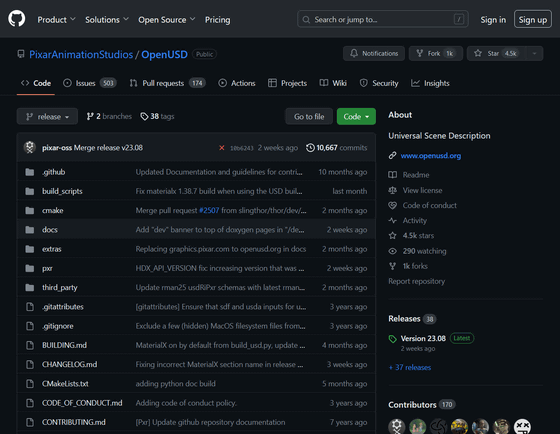
Find the location of `files`. files is located at coordinates (77, 306), (66, 331), (69, 349), (71, 365), (73, 381), (73, 407), (73, 422).